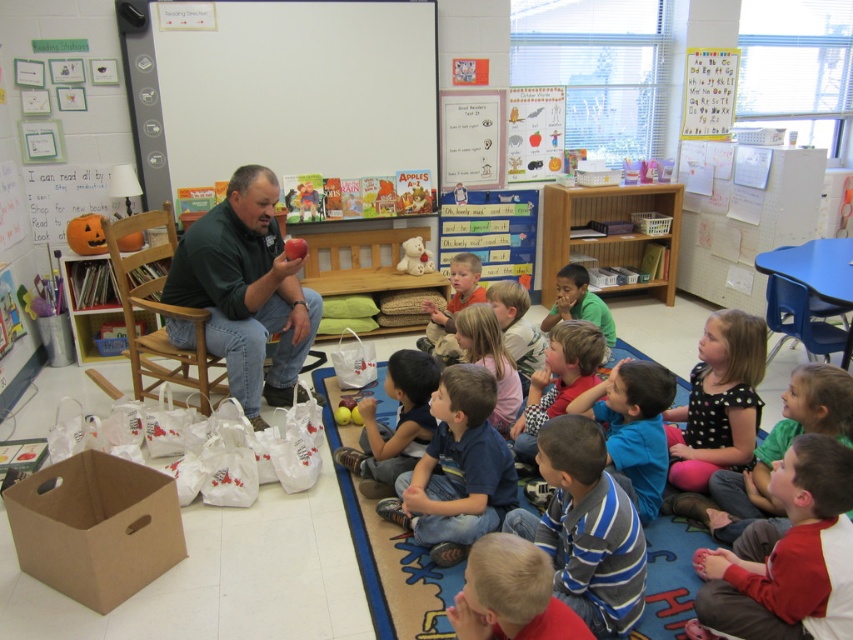
Question: Can you confirm if red cotton shirt at lower right is thinner than blue denim jeans at lower center?

Choices:
 (A) no
 (B) yes

Answer: (B)

Question: Which of the following is the farthest from the observer?

Choices:
 (A) green matte shirt at left
 (B) blue striped shirt at lower center

Answer: (A)

Question: Which point is farther from the camera taking this photo?

Choices:
 (A) coord(434,433)
 (B) coord(606,310)
 (C) coord(527,417)
 (D) coord(663,474)

Answer: (B)

Question: Among these points, which one is farthest from the camera?

Choices:
 (A) (497, 484)
 (B) (454, 262)
 (C) (286, 246)
 (D) (544, 397)

Answer: (B)

Question: Is striped cotton shirt at lower center closer to camera compared to smooth blue shirt at lower center?

Choices:
 (A) no
 (B) yes

Answer: (B)

Question: Is white matte board at upper center thinner than light pink fabric dress at center?

Choices:
 (A) no
 (B) yes

Answer: (A)